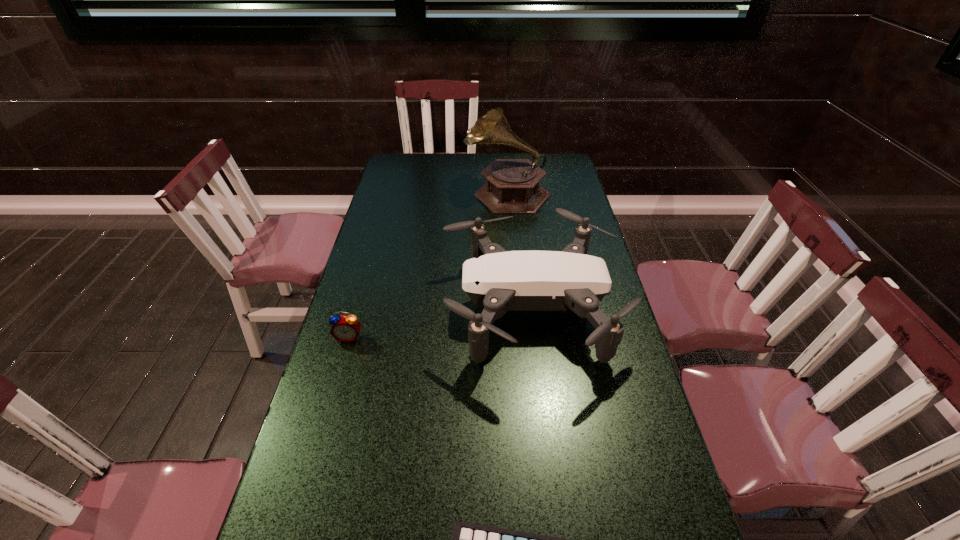
Where is `free space located on the camera side of the drone`? The height and width of the screenshot is (540, 960). free space located on the camera side of the drone is located at coordinates (422, 307).

Image resolution: width=960 pixels, height=540 pixels. Find the location of `free space located 0.290m on the front-facing side of the leftmost object`. free space located 0.290m on the front-facing side of the leftmost object is located at coordinates (318, 446).

At what (x,y) coordinates should I click in order to perform the action: click on object that is at the far edge. Please return your answer as a coordinate pair (x, y). This screenshot has width=960, height=540. Looking at the image, I should click on (512, 187).

Where is `object located at the left edge`? object located at the left edge is located at coordinates (346, 328).

Image resolution: width=960 pixels, height=540 pixels. I want to click on phonograph record present at the right edge, so click(512, 187).

In order to click on drone located in the right edge section of the desktop in this screenshot , I will do `click(496, 280)`.

The width and height of the screenshot is (960, 540). Find the location of `object at the far right corner`. object at the far right corner is located at coordinates (512, 187).

In the image, there is a desktop. Where is `vacant space at the far edge`? vacant space at the far edge is located at coordinates (431, 174).

Identify the location of vacant area at the left edge of the desktop. This screenshot has height=540, width=960. tap(357, 396).

I want to click on free space at the right edge, so click(x=549, y=215).